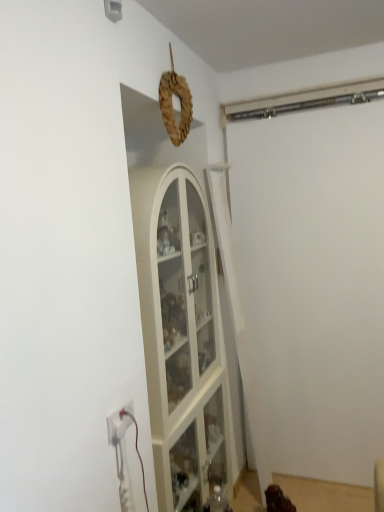
Question: Is white matte garage door at right shorter than white plastic electric outlet at lower left?

Choices:
 (A) yes
 (B) no

Answer: (B)

Question: Is white matte garage door at right looking in the opposite direction of white plastic electric outlet at lower left?

Choices:
 (A) yes
 (B) no

Answer: (B)

Question: Does white matte garage door at right come behind white plastic electric outlet at lower left?

Choices:
 (A) no
 (B) yes

Answer: (B)

Question: Are white matte garage door at right and white plastic electric outlet at lower left located far from each other?

Choices:
 (A) yes
 (B) no

Answer: (A)

Question: Is white matte garage door at right closer to camera compared to white plastic electric outlet at lower left?

Choices:
 (A) no
 (B) yes

Answer: (A)

Question: From the image's perspective, would you say white matte garage door at right is positioned over white plastic electric outlet at lower left?

Choices:
 (A) no
 (B) yes

Answer: (B)

Question: Considering the relative sizes of white plastic electric outlet at lower left and white matte garage door at right in the image provided, is white plastic electric outlet at lower left bigger than white matte garage door at right?

Choices:
 (A) yes
 (B) no

Answer: (B)

Question: From a real-world perspective, is white plastic electric outlet at lower left positioned over white matte garage door at right based on gravity?

Choices:
 (A) no
 (B) yes

Answer: (A)

Question: Is white plastic electric outlet at lower left wider than white matte garage door at right?

Choices:
 (A) yes
 (B) no

Answer: (B)

Question: Is white plastic electric outlet at lower left completely or partially outside of white matte garage door at right?

Choices:
 (A) no
 (B) yes

Answer: (B)

Question: From the image's perspective, is white plastic electric outlet at lower left above white matte garage door at right?

Choices:
 (A) yes
 (B) no

Answer: (B)

Question: Does white plastic electric outlet at lower left have a lesser height compared to white matte garage door at right?

Choices:
 (A) yes
 (B) no

Answer: (A)

Question: Considering the positions of white plastic electric outlet at lower left and white matte garage door at right in the image, is white plastic electric outlet at lower left wider or thinner than white matte garage door at right?

Choices:
 (A) wide
 (B) thin

Answer: (B)